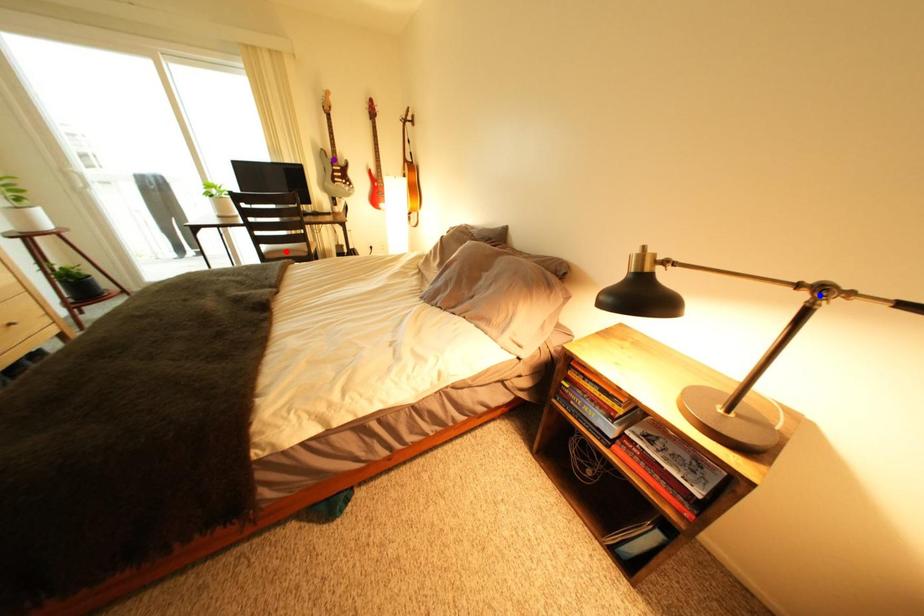
Order these from nearest to farthest:
red point, blue point, purple point

1. purple point
2. red point
3. blue point